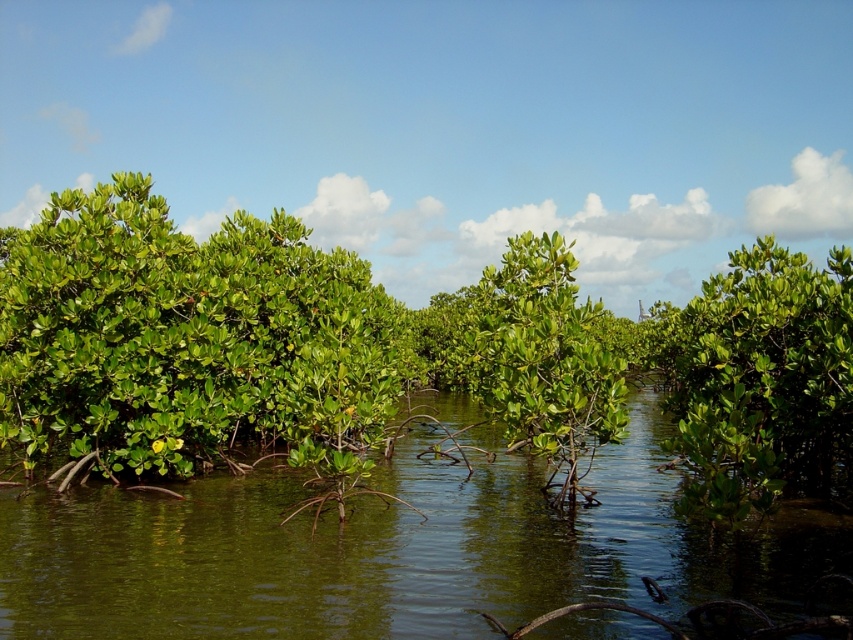
Which is more to the right, green leafy vegetation at center or green leafy plant at center?

Positioned to the right is green leafy plant at center.

Find the location of a particular element. This screenshot has width=853, height=640. green leafy vegetation at center is located at coordinates (392, 552).

Between point (51, 532) and point (802, 308), which one is positioned behind?

Positioned behind is point (802, 308).

In order to click on green leafy vegetation at center in this screenshot , I will do `click(392, 552)`.

Is green leafy vegetation at center thinner than green leafy bush at left?

No.

At what (x,y) coordinates should I click in order to perform the action: click on green leafy vegetation at center. Please return your answer as a coordinate pair (x, y). This screenshot has width=853, height=640. Looking at the image, I should click on (392, 552).

Based on the photo, is green leafy mangrove at center to the left of green leafy plant at center from the viewer's perspective?

Indeed, green leafy mangrove at center is positioned on the left side of green leafy plant at center.

This screenshot has height=640, width=853. Identify the location of green leafy mangrove at center. (399, 349).